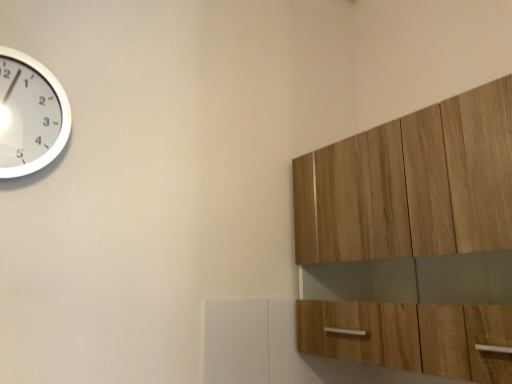
Question: Considering the relative sizes of white metallic clock at upper left and light wood cabinet at upper right in the image provided, is white metallic clock at upper left taller than light wood cabinet at upper right?

Choices:
 (A) yes
 (B) no

Answer: (B)

Question: From a real-world perspective, is white metallic clock at upper left located beneath light wood cabinet at upper right?

Choices:
 (A) yes
 (B) no

Answer: (B)

Question: Does white metallic clock at upper left have a lesser height compared to light wood cabinet at upper right?

Choices:
 (A) no
 (B) yes

Answer: (B)

Question: Is white metallic clock at upper left looking in the opposite direction of light wood cabinet at upper right?

Choices:
 (A) yes
 (B) no

Answer: (B)

Question: Is white metallic clock at upper left far from light wood cabinet at upper right?

Choices:
 (A) yes
 (B) no

Answer: (B)

Question: Is white metallic clock at upper left further to the viewer compared to light wood cabinet at upper right?

Choices:
 (A) yes
 (B) no

Answer: (A)

Question: Is light wood cabinet at upper right not within white metallic clock at upper left?

Choices:
 (A) no
 (B) yes

Answer: (B)

Question: Is light wood cabinet at upper right surrounding white metallic clock at upper left?

Choices:
 (A) yes
 (B) no

Answer: (B)

Question: Is the depth of light wood cabinet at upper right greater than that of white metallic clock at upper left?

Choices:
 (A) no
 (B) yes

Answer: (A)

Question: Is light wood cabinet at upper right oriented away from white metallic clock at upper left?

Choices:
 (A) no
 (B) yes

Answer: (A)

Question: Is light wood cabinet at upper right in contact with white metallic clock at upper left?

Choices:
 (A) no
 (B) yes

Answer: (A)

Question: From the image's perspective, is light wood cabinet at upper right located beneath white metallic clock at upper left?

Choices:
 (A) no
 (B) yes

Answer: (B)

Question: Which is correct: light wood cabinet at upper right is inside white metallic clock at upper left, or outside of it?

Choices:
 (A) outside
 (B) inside

Answer: (A)